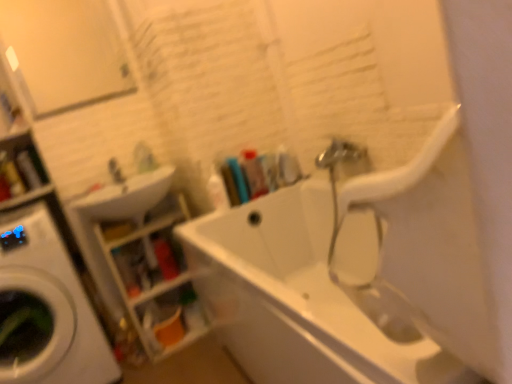
Question: From their relative heights in the image, would you say translucent plastic shelves at lower left is taller or shorter than white glossy sink at upper left?

Choices:
 (A) short
 (B) tall

Answer: (B)

Question: In terms of width, does translucent plastic shelves at lower left look wider or thinner when compared to white glossy sink at upper left?

Choices:
 (A) wide
 (B) thin

Answer: (B)

Question: Estimate the real-world distances between objects in this image. Which object is farther from the translucent plastic bottle at center, placed as the second toiletry when sorted from left to right?

Choices:
 (A) translucent plastic toothbrushes at upper center, which appears as the second toiletry when viewed from the right
 (B) white glossy bathtub at center
 (C) white glossy washing machine at left
 (D) translucent plastic bottle at upper left, which is the 4th toiletry from right to left
 (E) translucent plastic bottle at center, the 1th toiletry positioned from the right

Answer: (D)

Question: Estimate the real-world distances between objects in this image. Which object is farther from the translucent plastic shelves at lower left?

Choices:
 (A) translucent plastic bottle at center, the 1th toiletry positioned from the right
 (B) white glossy bathtub at center
 (C) translucent plastic bottle at center, placed as the second toiletry when sorted from left to right
 (D) satin nickel faucet at upper left
 (E) translucent plastic bottle at upper left, which is the 4th toiletry from right to left

Answer: (E)